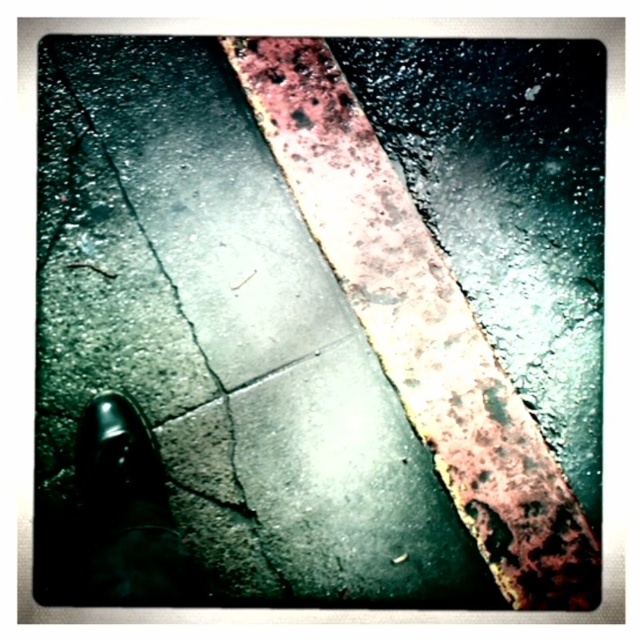
Question: Which of these objects is positioned farthest from the rusty metal curb at upper center?

Choices:
 (A) dark gray concrete crack at lower left
 (B) shiny black shoe at lower left

Answer: (B)

Question: Which object is farther from the camera taking this photo?

Choices:
 (A) dark gray concrete crack at lower left
 (B) shiny black shoe at lower left

Answer: (A)

Question: Is dark gray concrete crack at lower left closer to camera compared to rusty metal curb at upper center?

Choices:
 (A) no
 (B) yes

Answer: (B)

Question: Is dark gray concrete crack at lower left below shiny black shoe at lower left?

Choices:
 (A) yes
 (B) no

Answer: (B)

Question: Which object is the farthest from the rusty metal curb at upper center?

Choices:
 (A) shiny black shoe at lower left
 (B) dark gray concrete crack at lower left

Answer: (A)

Question: Is dark gray concrete crack at lower left thinner than shiny black shoe at lower left?

Choices:
 (A) yes
 (B) no

Answer: (B)